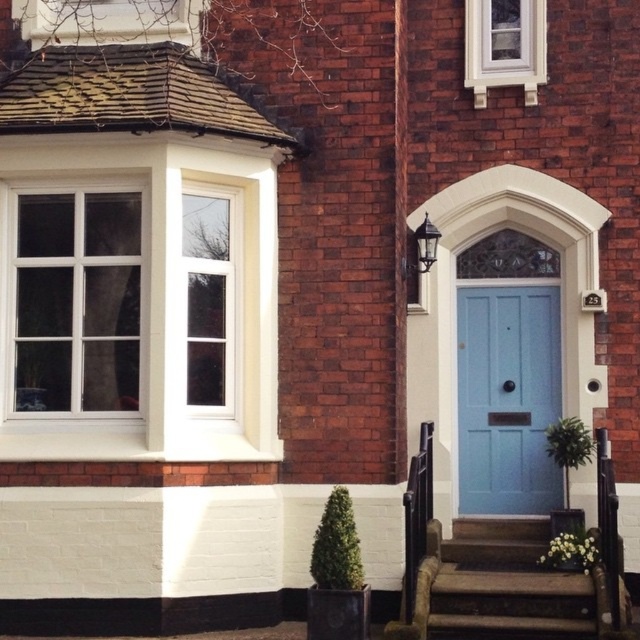
The height and width of the screenshot is (640, 640). Describe the element at coordinates (508, 397) in the screenshot. I see `light blue wooden door at center` at that location.

Is light blue wooden door at center below smooth stone stairs at center?

Actually, light blue wooden door at center is above smooth stone stairs at center.

What do you see at coordinates (508, 397) in the screenshot? I see `light blue wooden door at center` at bounding box center [508, 397].

Image resolution: width=640 pixels, height=640 pixels. Identify the location of light blue wooden door at center. (508, 397).

Is smooth stone stairs at center positioned in front of clear glass window at upper left?

Yes, it is in front of clear glass window at upper left.

Between smooth stone stairs at center and clear glass window at upper left, which one has more height?

clear glass window at upper left is taller.

Which is behind, point (470, 541) or point (212, 371)?

The point (470, 541) is more distant.

Image resolution: width=640 pixels, height=640 pixels. I want to click on smooth stone stairs at center, so click(502, 584).

Between light blue wooden door at center and clear glass window at upper left, which one appears on the right side from the viewer's perspective?

From the viewer's perspective, light blue wooden door at center appears more on the right side.

Between light blue wooden door at center and clear glass window at upper left, which one has less height?

clear glass window at upper left is shorter.

Between point (476, 417) and point (218, 328), which one is positioned behind?

Positioned behind is point (476, 417).

This screenshot has height=640, width=640. Find the location of `light blue wooden door at center`. light blue wooden door at center is located at coordinates [508, 397].